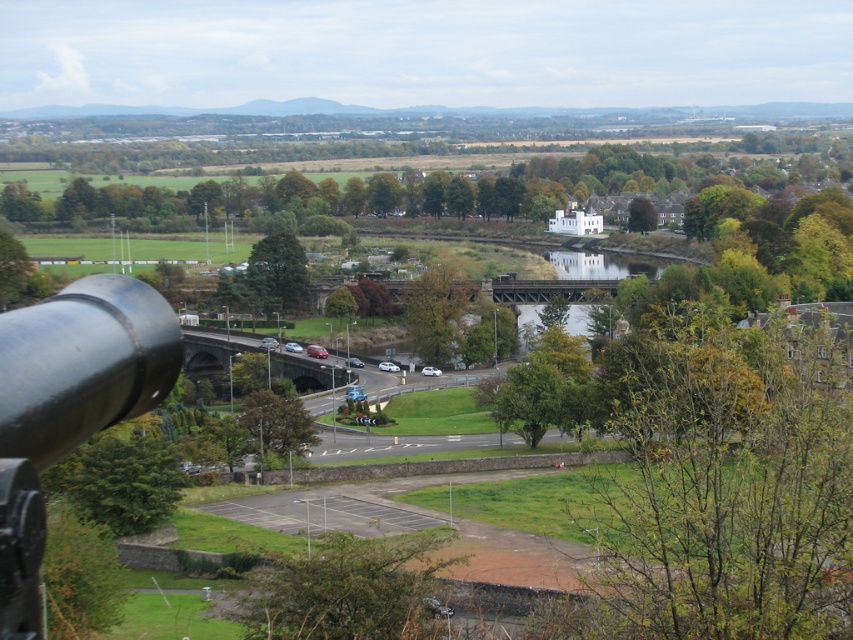
Does point (410, 588) lie in front of point (263, 400)?

Yes.

Who is taller, green leafy tree at lower center or green leafy tree at center?

Standing taller between the two is green leafy tree at center.

At what (x,y) coordinates should I click in order to perform the action: click on green leafy tree at lower center. Please return your answer as a coordinate pair (x, y). This screenshot has height=640, width=853. Looking at the image, I should click on (346, 589).

In the scene shown: Who is lower down, green leafy tree at lower right or green leafy tree at center?

Positioned lower is green leafy tree at center.

Where is `green leafy tree at lower right`? green leafy tree at lower right is located at coordinates (724, 483).

This screenshot has width=853, height=640. In order to click on green leafy tree at lower left in this screenshot , I will do `click(119, 481)`.

Measure the distance between point (x=158, y=502) and camera.

Point (x=158, y=502) and camera are 278.87 feet apart from each other.

Which is in front, point (167, 476) or point (281, 401)?

Positioned in front is point (167, 476).

I want to click on green leafy tree at lower left, so click(x=119, y=481).